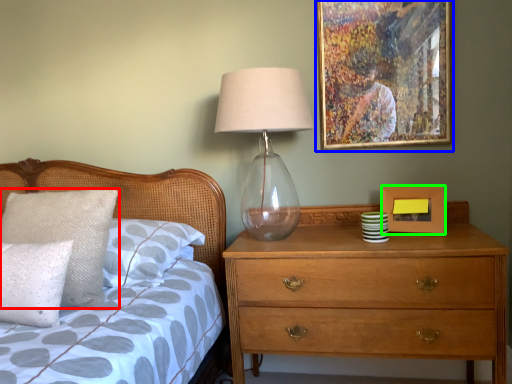
Question: Which is nearer to the pillow (highlighted by a red box)? picture frame (highlighted by a blue box) or picture frame (highlighted by a green box).

Choices:
 (A) picture frame
 (B) picture frame

Answer: (A)